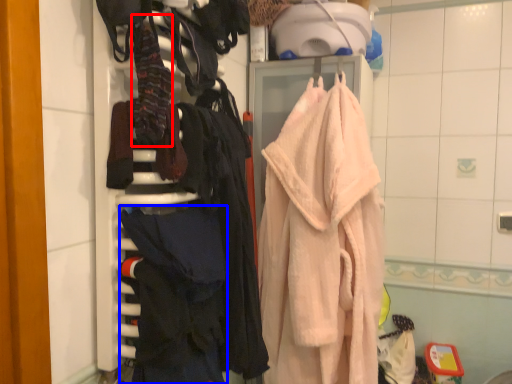
Question: Among these objects, which one is nearest to the camera, clothing (highlighted by a red box) or clothing (highlighted by a blue box)?

Choices:
 (A) clothing
 (B) clothing

Answer: (A)